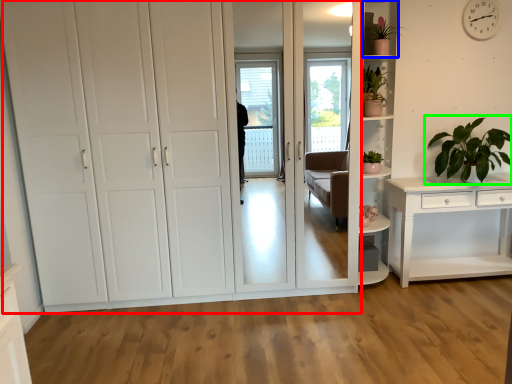
Question: Based on their relative distances, which object is farther from cupboard (highlighted by a red box)? Choose from shelf (highlighted by a blue box) and houseplant (highlighted by a green box).

Choices:
 (A) shelf
 (B) houseplant

Answer: (B)